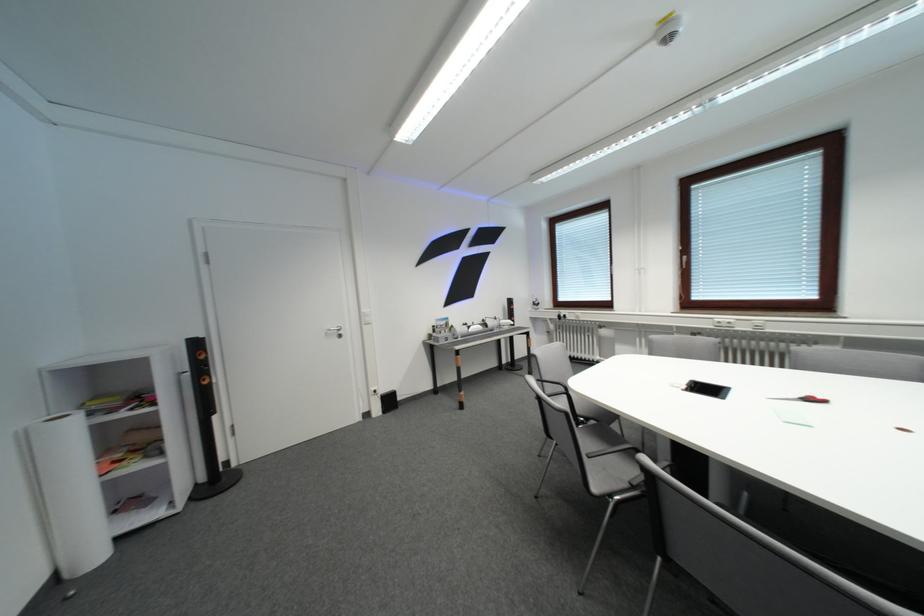
This screenshot has width=924, height=616. Find the location of `black smartphone`. black smartphone is located at coordinates (707, 389).